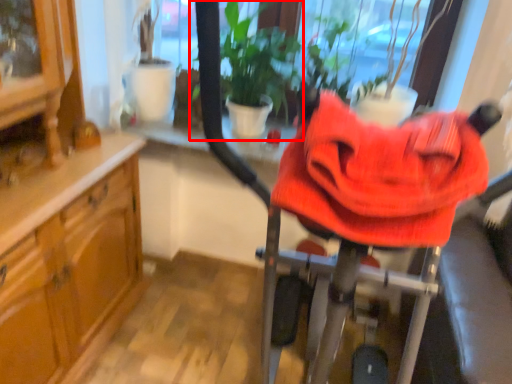
Question: From the image's perspective, considering the relative positions of houseplant (annotated by the red box) and baby carriage in the image provided, where is houseplant (annotated by the red box) located with respect to the staircase?

Choices:
 (A) below
 (B) above

Answer: (B)